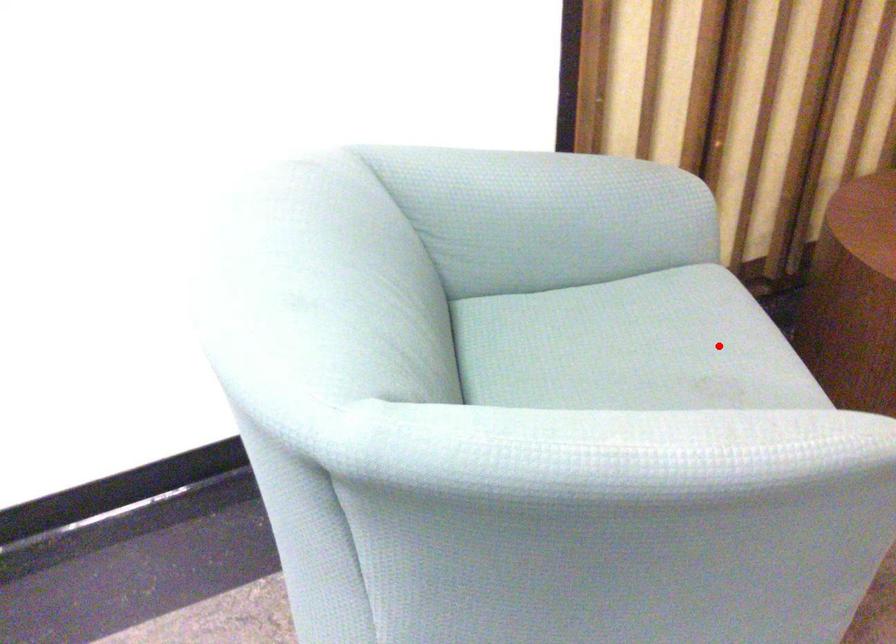
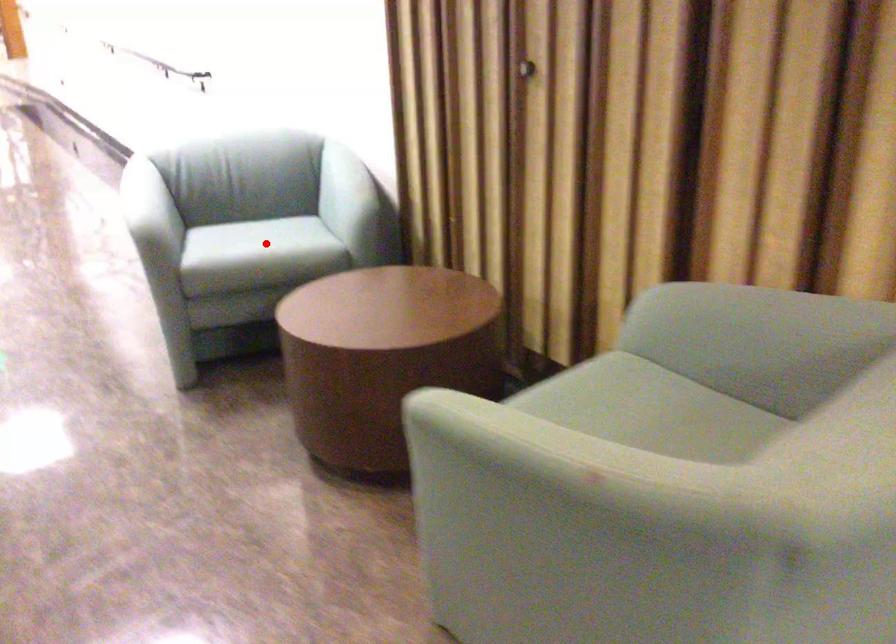
I am providing you with two images of the same scene from different viewpoints. A red point is marked on the first image and another point is marked on the second image. Is the marked point in image1 the same physical position as the marked point in image2?

Yes